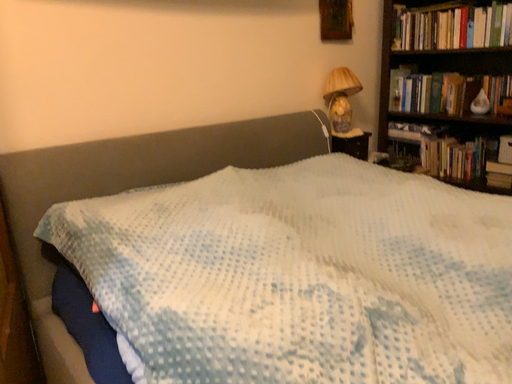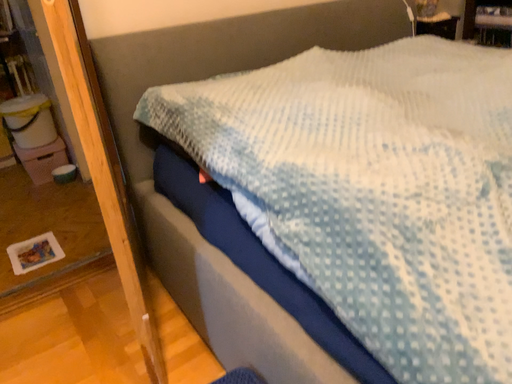
Question: Which way did the camera rotate in the video?

Choices:
 (A) rotated upward
 (B) rotated downward

Answer: (B)